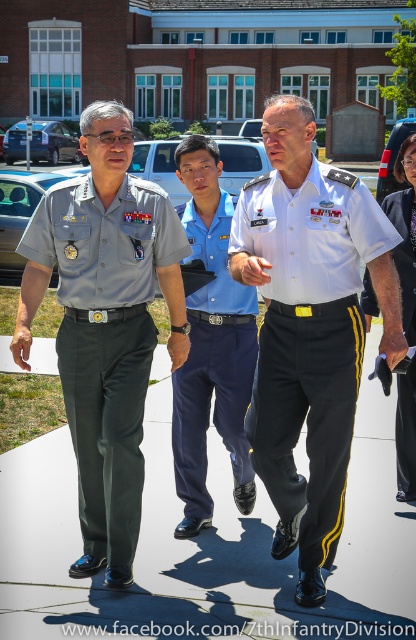
You are a photographer tasked with capturing a group photo of the individuals in the scene. You need to ensure that all subjects are visible in the frame. Given the sizes of the blue cotton shirt at center and the black smooth pants at right, which subject should you position closer to the camera to ensure their full visibility?

The blue cotton shirt at center is smaller than the black smooth pants at right. To ensure full visibility, position the blue cotton shirt at center closer to the camera since smaller objects appear smaller when farther away, so moving it closer would make it more visible in the frame.

You are a photographer trying to capture a clear shot of the white cotton shirt at center and the dark gray concrete pavement at center. Based on their sizes, which object would appear larger in your photo?

The dark gray concrete pavement at center might appear larger in the photo than the white cotton shirt at center since it is wider.